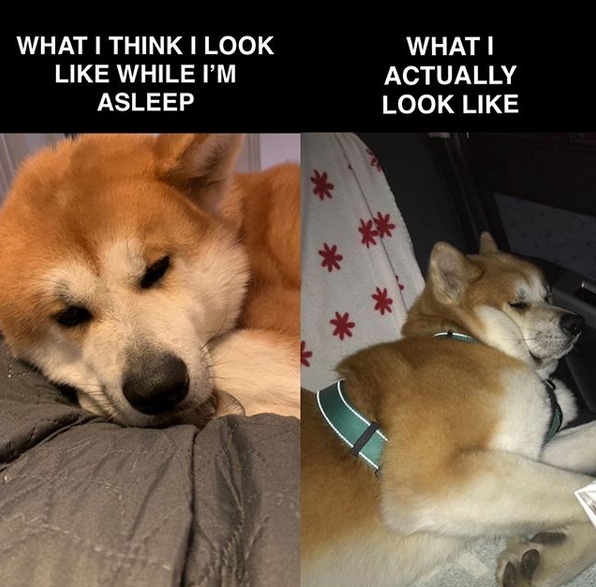
At what (x,y) coordinates should I click in order to perform the action: click on curtain. Please return your answer as a coordinate pair (x, y). This screenshot has height=587, width=596. Looking at the image, I should click on (375, 245).